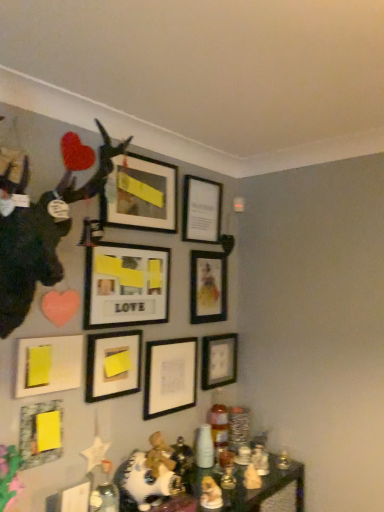
Question: Is shiny glass table at lower center taller or shorter than matte black picture frame at upper center, which ranks as the 1th picture frame in top-to-bottom order?

Choices:
 (A) tall
 (B) short

Answer: (A)

Question: Does point (273, 477) appear closer or farther from the camera than point (109, 178)?

Choices:
 (A) closer
 (B) farther

Answer: (B)

Question: Based on their relative distances, which object is farther from the shiny glass table at lower center?

Choices:
 (A) yellow matte picture frame at lower left, the first picture frame positioned from the bottom
 (B) matte black picture frame at upper center, the 8th picture frame in the bottom-to-top sequence
 (C) matte black picture frame at center, which appears as the eighth picture frame when viewed from the top
 (D) matte black picture frame at lower right, positioned as the seventh picture frame in top-to-bottom order
 (E) matte wooden picture frame at center, the 7th picture frame ordered from the bottom

Answer: (B)

Question: Estimate the real-world distances between objects in this image. Which object is closer to the yellow matte picture frame at lower left, the first picture frame positioned from the bottom?

Choices:
 (A) black matte deer head at upper left
 (B) matte black picture frame at center-right, marked as the 4th picture frame in a top-to-bottom arrangement
 (C) matte yellow paper at center, placed as the fourth picture frame when sorted from bottom to top
 (D) yellow paper at lower left, the 5th picture frame when ordered from top to bottom
 (E) matte black picture frame at upper center, which ranks as the 1th picture frame in top-to-bottom order

Answer: (D)